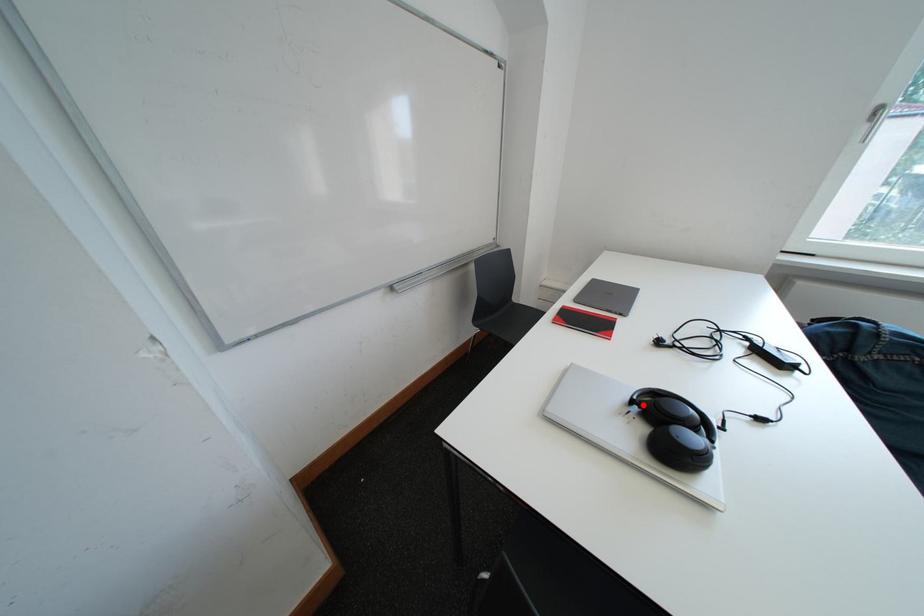
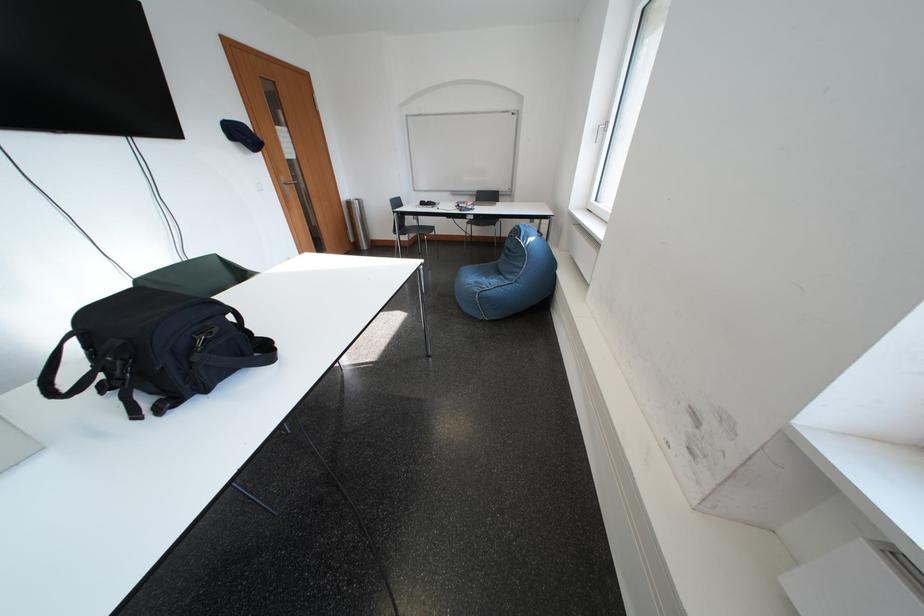
Question: I am providing you with two images of the same scene from different viewpoints. A red point is marked on the first image. At the location where the point appears in image 1, is it still visible in image 2?

Choices:
 (A) Yes
 (B) No

Answer: (B)